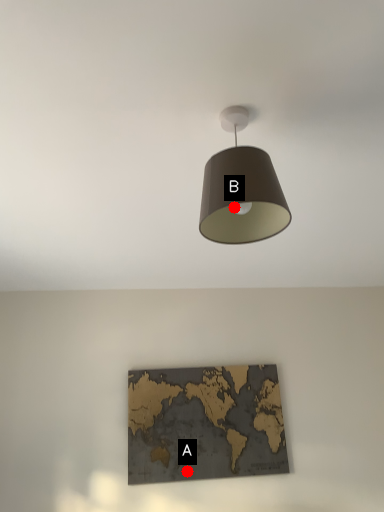
Question: Two points are circled on the image, labeled by A and B beside each circle. Which point is closer to the camera?

Choices:
 (A) A is closer
 (B) B is closer

Answer: (B)